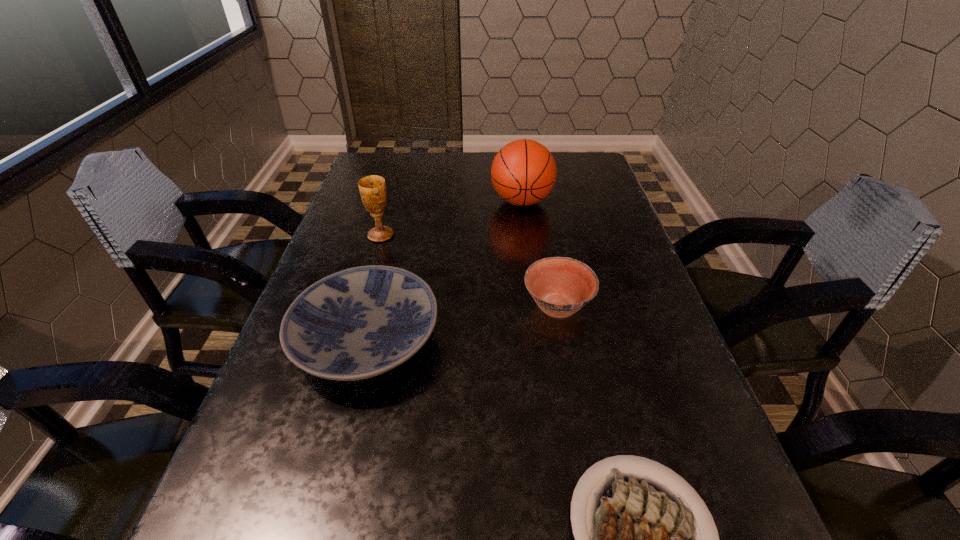
The image size is (960, 540). Find the location of `object positioned at the far edge`. object positioned at the far edge is located at coordinates (523, 172).

Where is `chalice positioned at the left edge`? chalice positioned at the left edge is located at coordinates (372, 188).

At what (x,y) coordinates should I click in order to perform the action: click on plate that is at the left edge. Please return your answer as a coordinate pair (x, y). Looking at the image, I should click on (361, 322).

Locate an element on the screen. object that is positioned at the right edge is located at coordinates (560, 286).

This screenshot has height=540, width=960. In the image, there is a desktop. Find the location of `free region at the far edge`. free region at the far edge is located at coordinates (482, 187).

The width and height of the screenshot is (960, 540). I want to click on free space at the left edge, so click(x=388, y=207).

The height and width of the screenshot is (540, 960). In order to click on vacant space at the right edge of the desktop in this screenshot , I will do `click(607, 354)`.

Where is `vacant space at the far left corner of the desktop`? vacant space at the far left corner of the desktop is located at coordinates (374, 156).

The image size is (960, 540). Find the location of `vacant area between the fourth shortest object and the basketball`. vacant area between the fourth shortest object and the basketball is located at coordinates point(451,218).

At what (x,y) coordinates should I click in order to perform the action: click on free space between the fourth shortest object and the bowl. Please return your answer as a coordinate pair (x, y). Looking at the image, I should click on [468, 271].